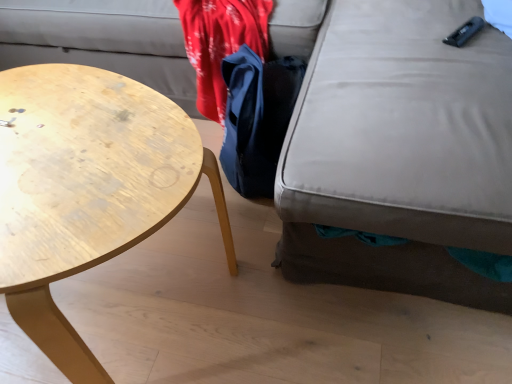
Question: Is matte gray swivel chair at lower right in front of or behind blue fabric bag at center in the image?

Choices:
 (A) behind
 (B) front

Answer: (B)

Question: Is matte gray swivel chair at lower right situated inside blue fabric bag at center or outside?

Choices:
 (A) outside
 (B) inside

Answer: (A)

Question: Which object is the farthest from the matte gray swivel chair at lower right?

Choices:
 (A) blue fabric bag at center
 (B) wooden coffee table at left

Answer: (B)

Question: Which is nearer to the blue fabric bag at center?

Choices:
 (A) wooden coffee table at left
 (B) matte gray swivel chair at lower right

Answer: (B)